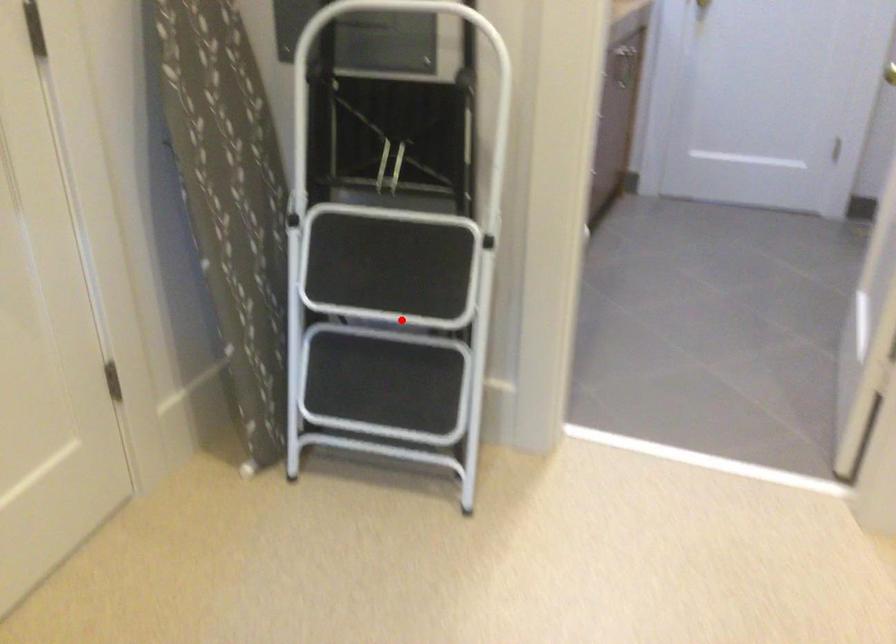
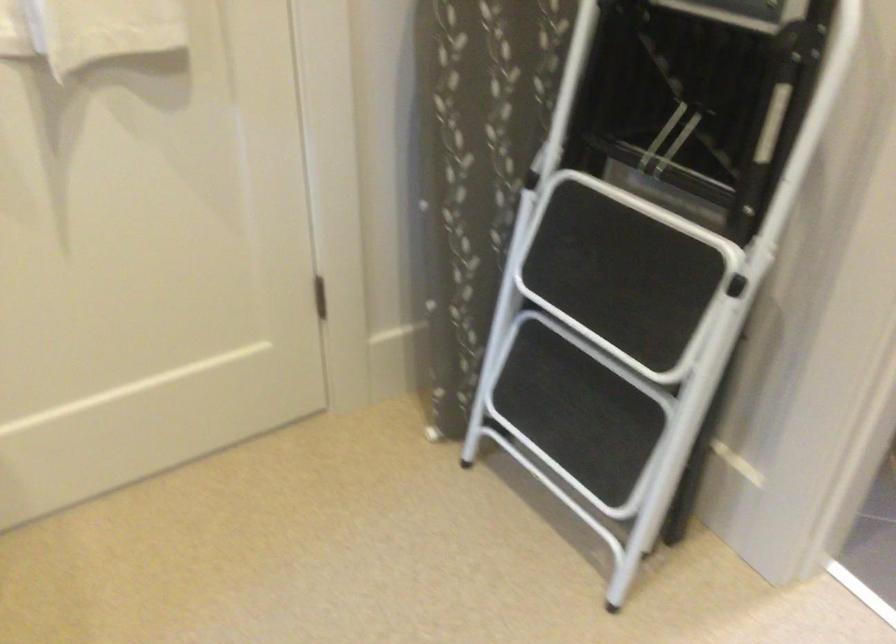
In the second image, find the point that corresponds to the highlighted location in the first image.

(607, 342)